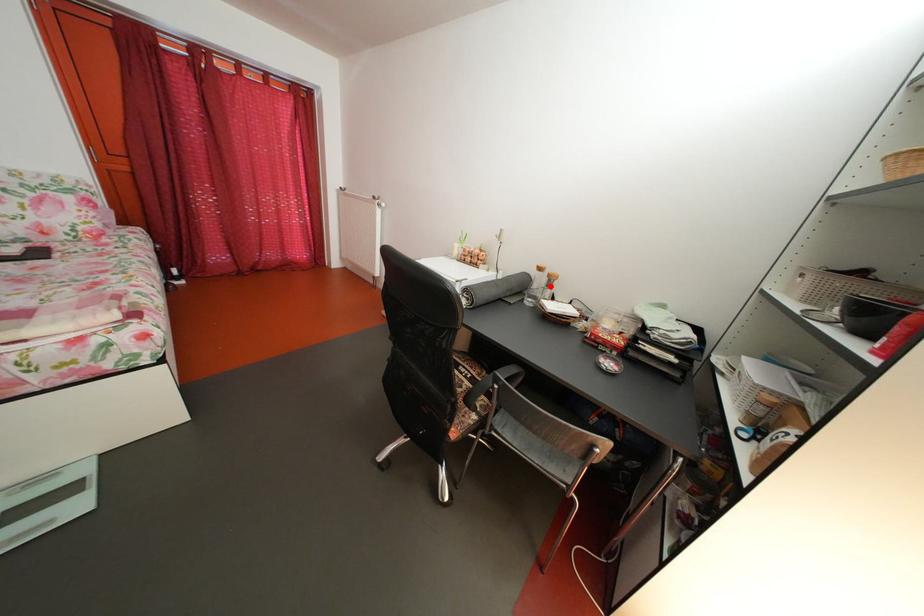
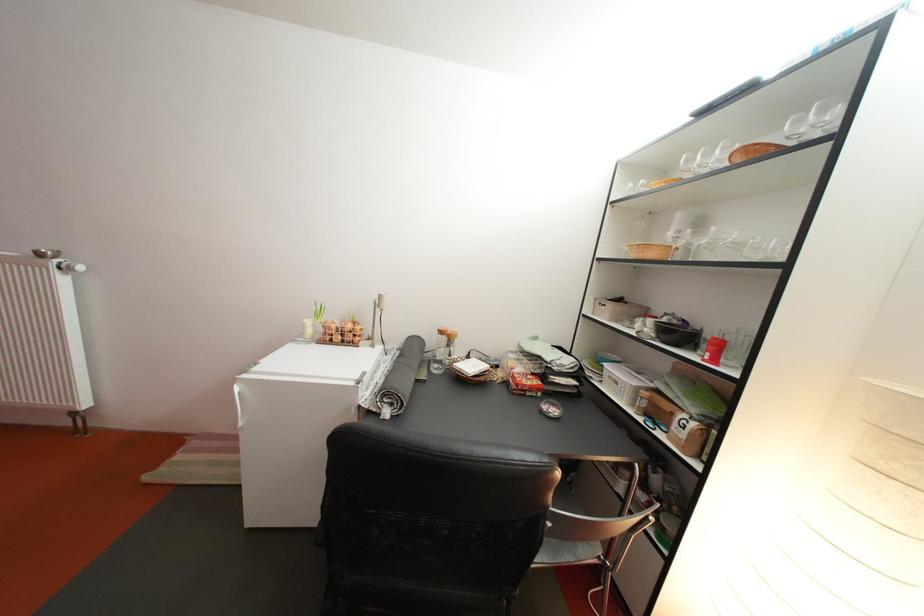
Find the pixel in the second image that matches the highlighted location in the first image.

(444, 346)